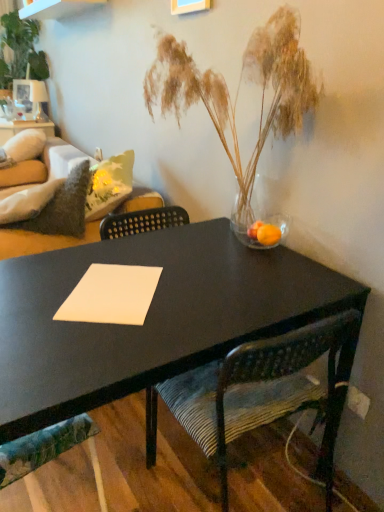
Question: Is white paper at center bigger or smaller than velvet green couch at left?

Choices:
 (A) big
 (B) small

Answer: (B)

Question: From the image's perspective, is white paper at center located above or below velvet green couch at left?

Choices:
 (A) above
 (B) below

Answer: (B)

Question: Estimate the real-world distances between objects in this image. Which object is farther from the translucent glass vase with dried grasses at center?

Choices:
 (A) white paper at center
 (B) white fluffy pillow at upper left
 (C) textured fabric chair at lower left, which is counted as the 1th chair, starting from the left
 (D) green leafy plant at upper left
 (E) translucent glass vase at right

Answer: (D)

Question: Considering the real-world distances, which object is farthest from the translucent glass vase with dried grasses at center?

Choices:
 (A) green leafy plant at upper left
 (B) translucent glass vase at right
 (C) white fluffy pillow at upper left
 (D) textured fabric chair at lower left, arranged as the second chair when viewed from the right
 (E) velvet green couch at left

Answer: (A)